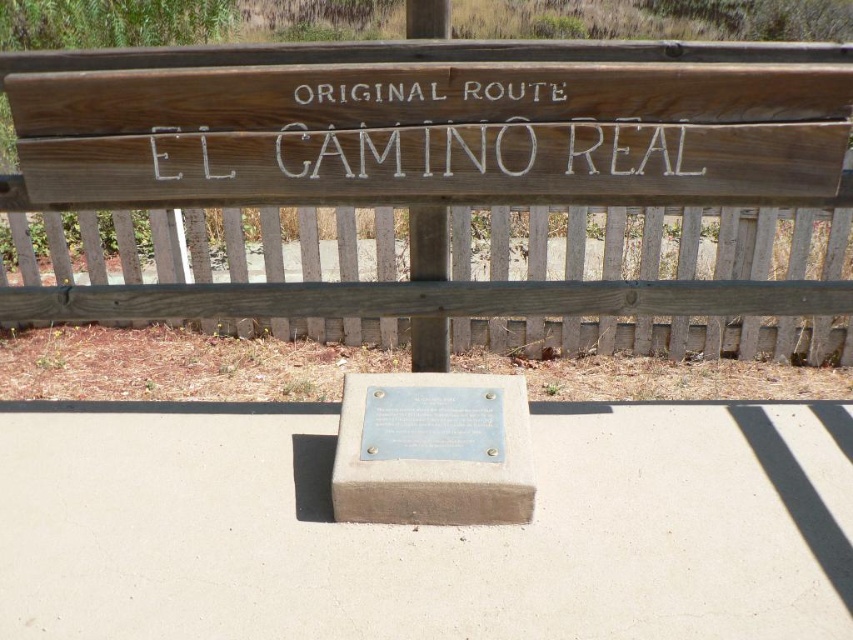
You are a road worker who needs to replace the wooden sign at center and the gray concrete plaque at center with new ones. The new signs must be exactly the same size as the existing ones. Which object requires a larger replacement piece?

The wooden sign at center requires a larger replacement piece because its width is larger than the gray concrete plaque at center.

You are a hiker who wants to read the inscription on the gray concrete plaque at center. The wooden sign at center is blocking your view. Can you move around to see the plaque? Explain why or why not based on their positions.

The gray concrete plaque at center is behind the wooden sign at center, so you can move around to the side or behind the wooden sign at center to get a clear view of the plaque.